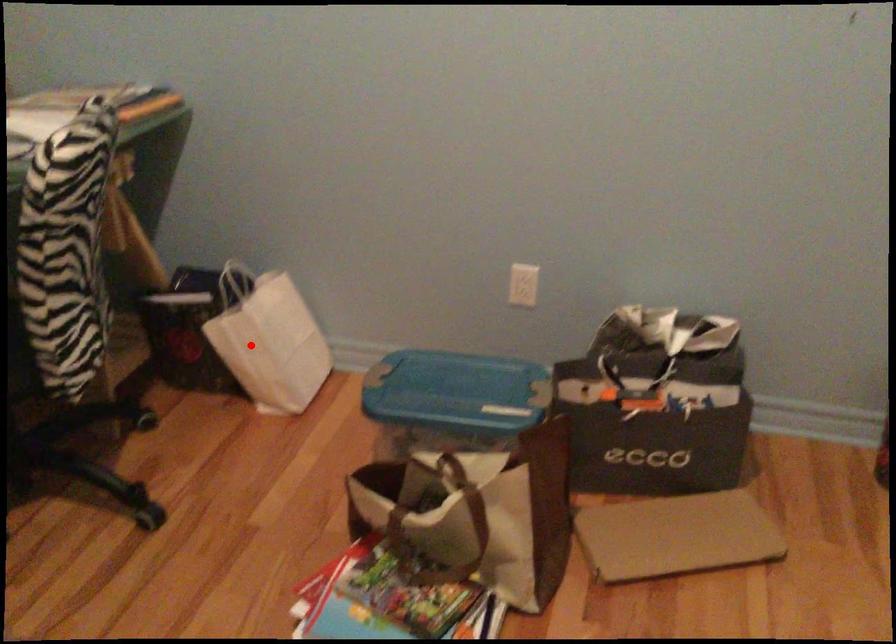
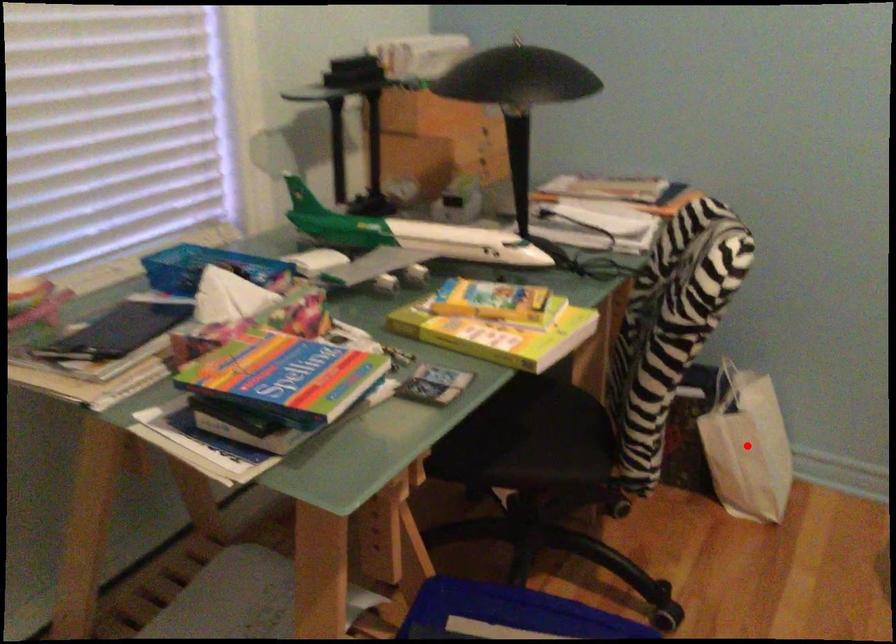
I am providing you with two images of the same scene from different viewpoints. A red point is marked on the first image and another point is marked on the second image. Are the points marked in image1 and image2 representing the same 3D position?

Yes